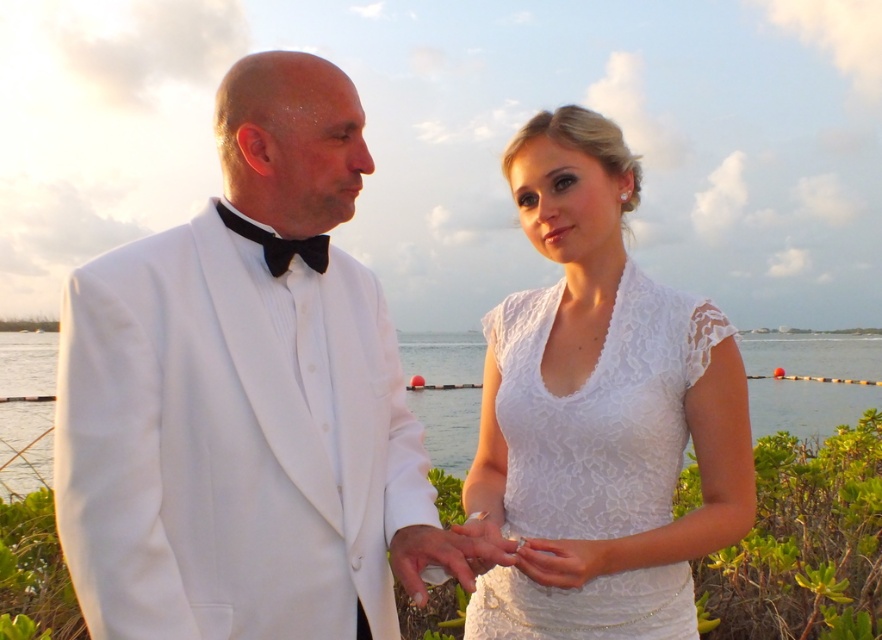
Between white satin tuxedo at left and clear water at center, which one appears on the right side from the viewer's perspective?

From the viewer's perspective, white satin tuxedo at left appears more on the right side.

Is white satin tuxedo at left smaller than clear water at center?

Correct, white satin tuxedo at left occupies less space than clear water at center.

Where is `white satin tuxedo at left`? Image resolution: width=882 pixels, height=640 pixels. white satin tuxedo at left is located at coordinates (247, 397).

Who is more distant from viewer, [359,132] or [520,440]?

The point [520,440] is behind.

Between white satin tuxedo at left and lace fabric dress at center, which one appears on the right side from the viewer's perspective?

From the viewer's perspective, lace fabric dress at center appears more on the right side.

Is point (349, 168) positioned in front of point (622, 154)?

That is True.

Find the location of `white satin tuxedo at left`. white satin tuxedo at left is located at coordinates (247, 397).

Which is more to the left, lace fabric dress at center or clear water at center?

clear water at center

Is point (477, 593) farther from camera compared to point (776, 397)?

No.

The image size is (882, 640). What are the coordinates of `lace fabric dress at center` in the screenshot? It's located at (599, 412).